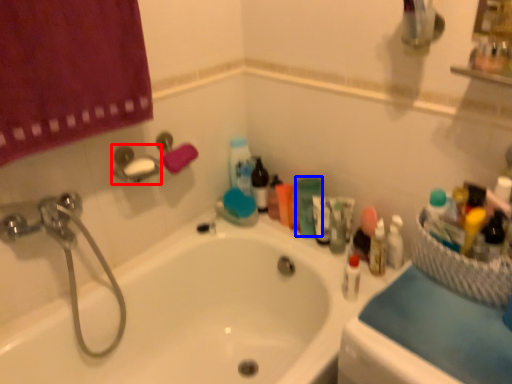
Question: Which of the following is the closest to the observer, towel bar (highlighted by a red box) or toiletry (highlighted by a blue box)?

Choices:
 (A) towel bar
 (B) toiletry

Answer: (A)